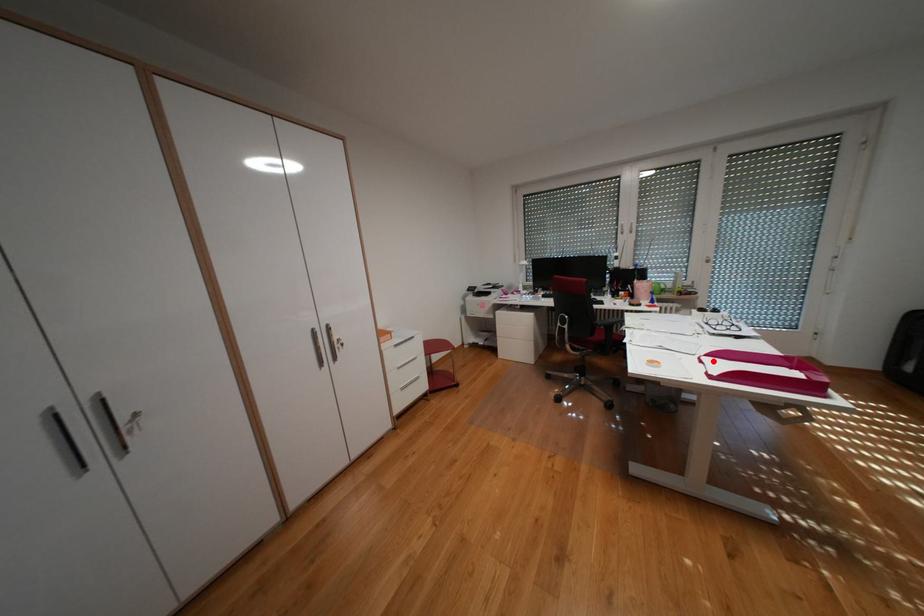
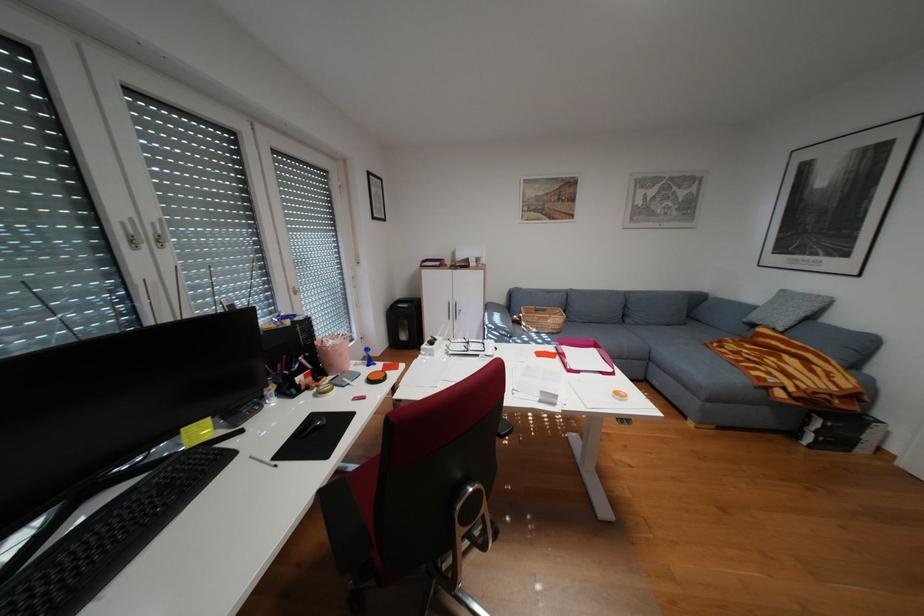
Where in the second image is the point corresponding to the highlighted location from the first image?

(590, 371)